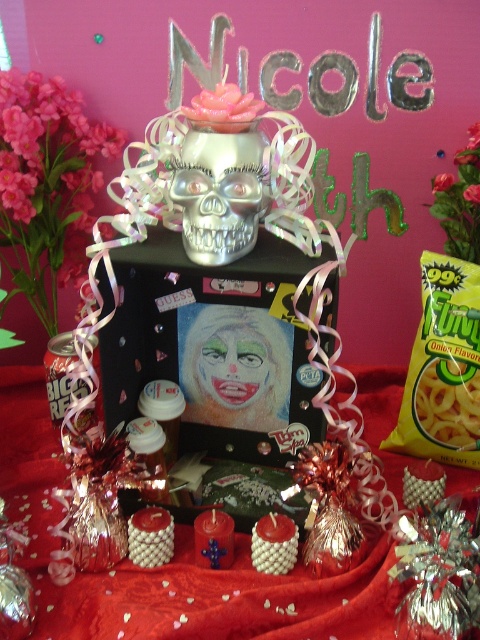
You are looking at the image of the themed party setup. There are two points marked in the scene. Which point, point (x=301, y=612) or point (x=192, y=234), is closer to you?

Point (x=301, y=612) is closer to the camera than point (x=192, y=234).

You are a guest at Nicole s party and you see the red satin tablecloth at center and the silver metallic skull at center. Which object has a greater width?

The red satin tablecloth at center has a greater width than the silver metallic skull at center.

You are a photographer holding a camera and standing in front of the red satin tablecloth at center. You want to take a photo of the tablecloth without any obstructions. Is the distance between you and the tablecloth sufficient to allow you to capture the entire tablecloth in one frame?

The distance between the camera and the red satin tablecloth at center is 26.43 inches. To determine if this distance is sufficient, consider the camera lens and its field of view. Assuming a standard lens with a 50mm focal length, at 26.43 inches, the entire tablecloth might fit depending on its size. However, if the tablecloth is large, you might need to step back slightly. Since the exact tablecloth dimensions aren